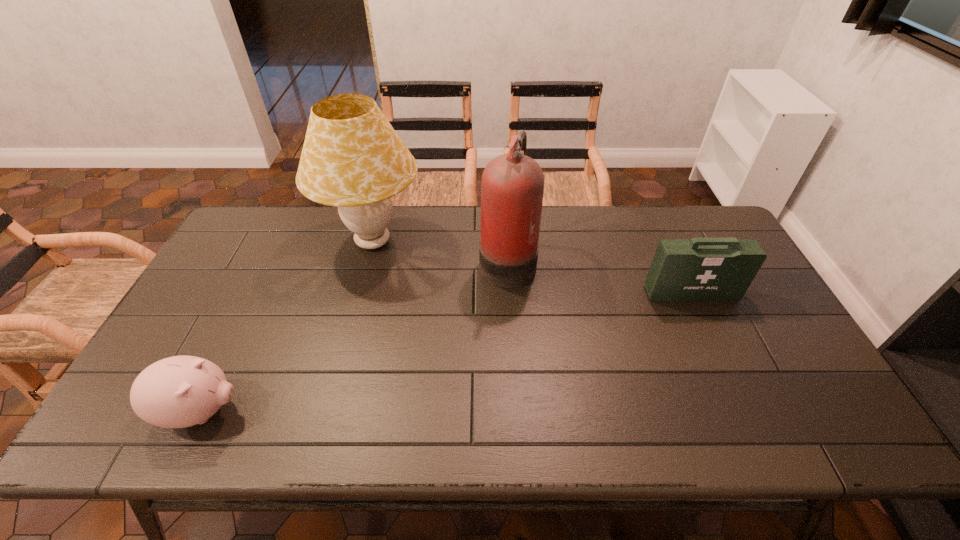
Locate an element on the screen. vacant space in between the fire extinguisher and the third object from right to left is located at coordinates (440, 251).

Image resolution: width=960 pixels, height=540 pixels. Identify the location of free point between the fire extinguisher and the second object from left to right. (440, 251).

Locate an element on the screen. This screenshot has height=540, width=960. free space between the second object from right to left and the leftmost object is located at coordinates (354, 335).

Locate an element on the screen. The image size is (960, 540). empty space that is in between the nearest object and the first-aid kit is located at coordinates (446, 352).

Identify which object is the closest to the shortest object. Please provide its 2D coordinates. Your answer should be formatted as a tuple, i.e. [(x, y)], where the tuple contains the x and y coordinates of a point satisfying the conditions above.

[(352, 158)]

Where is `object that is the closest to the third object from right to left`? Image resolution: width=960 pixels, height=540 pixels. object that is the closest to the third object from right to left is located at coordinates tap(512, 187).

Locate an element on the screen. The image size is (960, 540). free space in the image that satisfies the following two spatial constraints: 1. on the front-facing side of the first-aid kit; 2. at the snout of the leftmost object is located at coordinates (745, 411).

At what (x,y) coordinates should I click in order to perform the action: click on free space that satisfies the following two spatial constraints: 1. on the front-facing side of the rightmost object; 2. at the snout of the leftmost object. Please return your answer as a coordinate pair (x, y). Image resolution: width=960 pixels, height=540 pixels. Looking at the image, I should click on (745, 411).